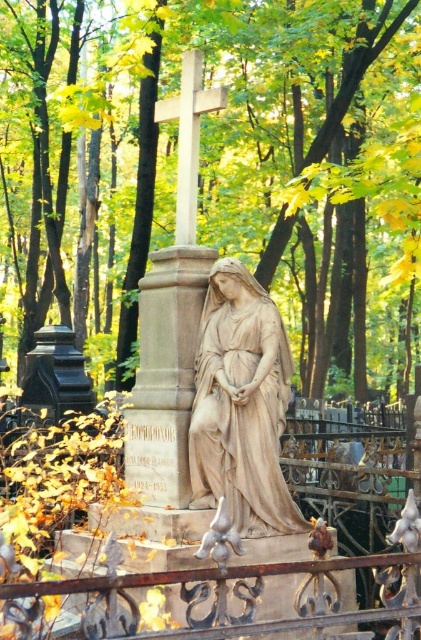
Is green leafy tree at center below brown wrought iron fence at lower center?

No.

Which is behind, point (253, 93) or point (240, 593)?

The point (253, 93) is behind.

Identify the location of green leafy tree at center. The height and width of the screenshot is (640, 421). click(x=303, y=134).

Can you confirm if beige stone statue at center is shorter than white stone cross at center?

Yes.

Who is lower down, beige stone statue at center or white stone cross at center?

beige stone statue at center

Image resolution: width=421 pixels, height=640 pixels. I want to click on beige stone statue at center, so click(240, 404).

Is brown wrought iron fence at lower center positioned behind white stone cross at center?

That is False.

Who is higher up, brown wrought iron fence at lower center or white stone cross at center?

white stone cross at center is above.

Which is in front, point (116, 600) or point (189, 100)?

Point (116, 600)

Where is `brown wrought iron fence at lower center`? brown wrought iron fence at lower center is located at coordinates (240, 593).